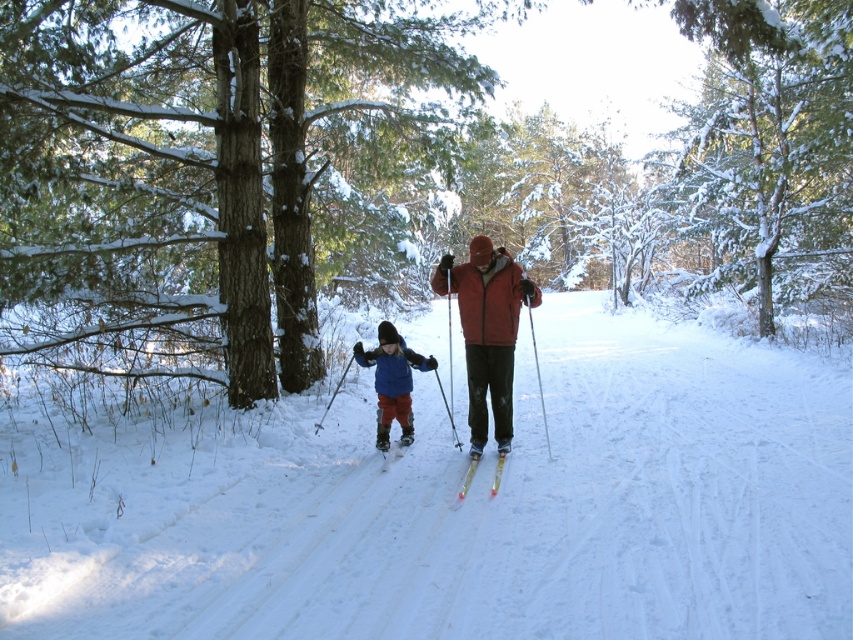
You are standing at the edge of the trail and want to take a photo of the white powdery snow at center and the matte red jacket at center. Which object will appear larger in your photo?

The white powdery snow at center will appear larger in the photo because it is closer to the viewer than the matte red jacket at center.

You are a photographer planning to take a group photo of the matte red jacket at center and the blue fleece jacket at center. Based on their positions in the image, which jacket should you focus on first to ensure both are in frame?

The matte red jacket at center is taller than the blue fleece jacket at center, so you should focus on the matte red jacket at center first to ensure both are in frame.